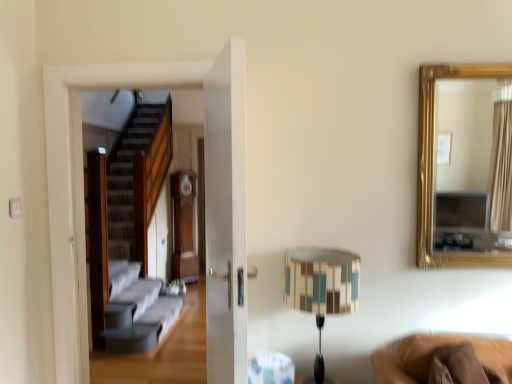
Find the location of a particular element. The width and height of the screenshot is (512, 384). multicolored fabric lampshade at center is located at coordinates (321, 287).

This screenshot has height=384, width=512. What do you see at coordinates (321, 287) in the screenshot? I see `multicolored fabric lampshade at center` at bounding box center [321, 287].

Measure the distance between multicolored fabric lampshade at center and camera.

multicolored fabric lampshade at center is 1.87 meters from camera.

What do you see at coordinates (473, 165) in the screenshot? I see `gold-framed mirror at upper right` at bounding box center [473, 165].

Locate an element on the screen. This screenshot has height=384, width=512. gold-framed mirror at upper right is located at coordinates (473, 165).

Identify the location of multicolored fabric lampshade at center. (321, 287).

Looking at this image, based on their positions, is multicolored fabric lampshade at center located to the left or right of gold-framed mirror at upper right?

multicolored fabric lampshade at center is to the left of gold-framed mirror at upper right.

Which object is closer to the camera taking this photo, multicolored fabric lampshade at center or gold-framed mirror at upper right?

multicolored fabric lampshade at center is in front.

Does point (336, 283) lie in front of point (435, 140)?

That is True.

From the image's perspective, is multicolored fabric lampshade at center below gold-framed mirror at upper right?

Yes, from the image's perspective, multicolored fabric lampshade at center is below gold-framed mirror at upper right.

From a real-world perspective, is multicolored fabric lampshade at center above or below gold-framed mirror at upper right?

Clearly, from a real-world perspective, multicolored fabric lampshade at center is below gold-framed mirror at upper right.

Considering the relative sizes of multicolored fabric lampshade at center and gold-framed mirror at upper right in the image provided, is multicolored fabric lampshade at center wider than gold-framed mirror at upper right?

Indeed, multicolored fabric lampshade at center has a greater width compared to gold-framed mirror at upper right.

Considering the relative sizes of multicolored fabric lampshade at center and gold-framed mirror at upper right in the image provided, is multicolored fabric lampshade at center shorter than gold-framed mirror at upper right?

Yes, multicolored fabric lampshade at center is shorter than gold-framed mirror at upper right.

Based on the photo, considering the sizes of objects multicolored fabric lampshade at center and gold-framed mirror at upper right in the image provided, who is bigger, multicolored fabric lampshade at center or gold-framed mirror at upper right?

multicolored fabric lampshade at center is bigger.

Can gold-framed mirror at upper right be found inside multicolored fabric lampshade at center?

No, multicolored fabric lampshade at center does not contain gold-framed mirror at upper right.

Is multicolored fabric lampshade at center with gold-framed mirror at upper right?

multicolored fabric lampshade at center and gold-framed mirror at upper right are clearly separated.

Is gold-framed mirror at upper right at the back of multicolored fabric lampshade at center?

No, multicolored fabric lampshade at center is not facing the opposite direction of gold-framed mirror at upper right.

Based on the photo, how different are the orientations of multicolored fabric lampshade at center and gold-framed mirror at upper right in degrees?

multicolored fabric lampshade at center and gold-framed mirror at upper right are facing 0.135 degrees away from each other.

Identify the location of table lamp that is on the left side of gold-framed mirror at upper right. Image resolution: width=512 pixels, height=384 pixels. (321, 287).

Considering the positions of objects gold-framed mirror at upper right and multicolored fabric lampshade at center in the image provided, who is more to the right, gold-framed mirror at upper right or multicolored fabric lampshade at center?

gold-framed mirror at upper right.

Is gold-framed mirror at upper right further to camera compared to multicolored fabric lampshade at center?

Yes, gold-framed mirror at upper right is further from the viewer.

Between point (499, 247) and point (347, 252), which one is positioned behind?

Positioned behind is point (499, 247).

From the image's perspective, relative to multicolored fabric lampshade at center, is gold-framed mirror at upper right above or below?

Based on their image positions, gold-framed mirror at upper right is located above multicolored fabric lampshade at center.

From a real-world perspective, which object stands above the other?

In real-world perspective, gold-framed mirror at upper right is above.

Is gold-framed mirror at upper right thinner than multicolored fabric lampshade at center?

Indeed, gold-framed mirror at upper right has a lesser width compared to multicolored fabric lampshade at center.

Does gold-framed mirror at upper right have a lesser height compared to multicolored fabric lampshade at center?

Incorrect, the height of gold-framed mirror at upper right does not fall short of that of multicolored fabric lampshade at center.

Is gold-framed mirror at upper right bigger than multicolored fabric lampshade at center?

No, gold-framed mirror at upper right is not bigger than multicolored fabric lampshade at center.

Can multicolored fabric lampshade at center be found inside gold-framed mirror at upper right?

No, multicolored fabric lampshade at center is not a part of gold-framed mirror at upper right.

Is gold-framed mirror at upper right directly adjacent to multicolored fabric lampshade at center?

gold-framed mirror at upper right is not next to multicolored fabric lampshade at center, and they're not touching.

Could you tell me if gold-framed mirror at upper right is facing multicolored fabric lampshade at center?

No, gold-framed mirror at upper right is not aimed at multicolored fabric lampshade at center.

Measure the distance from gold-framed mirror at upper right to multicolored fabric lampshade at center.

The distance of gold-framed mirror at upper right from multicolored fabric lampshade at center is 13.44 feet.

This screenshot has height=384, width=512. What are the coordinates of `mirror to the right of multicolored fabric lampshade at center` in the screenshot? It's located at (473, 165).

This screenshot has width=512, height=384. Identify the location of table lamp that appears below the gold-framed mirror at upper right (from a real-world perspective). (321, 287).

Find the location of a particular element. table lamp on the left of gold-framed mirror at upper right is located at coordinates point(321,287).